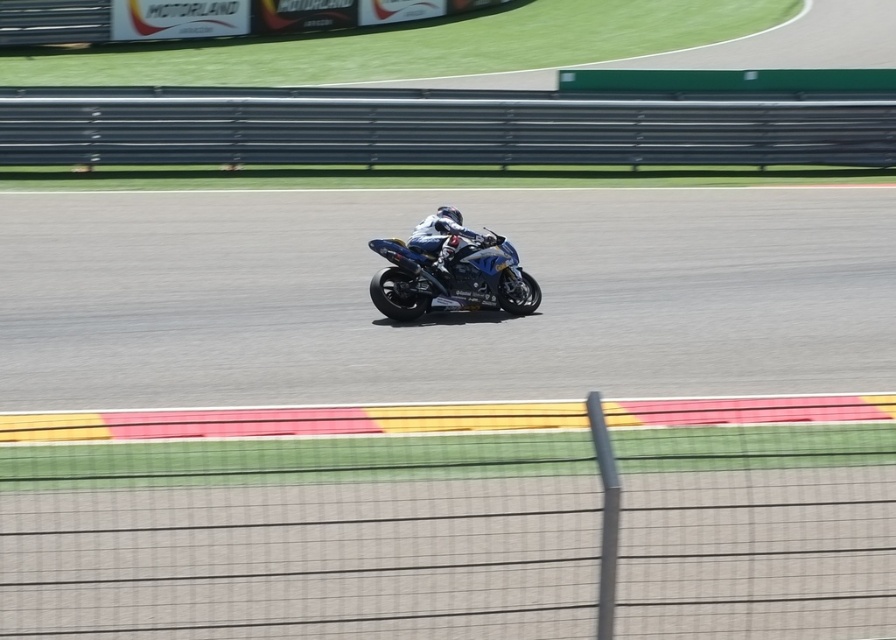
You are a photographer at the motor racing track. You want to take a photo of the blue metallic motorcycle at center and the white matte helmet at center. Which object should you zoom in on if you want to capture more details of the smaller one?

The white matte helmet at center is smaller than the blue metallic motorcycle at center, so you should zoom in on the white matte helmet at center to capture more details of the smaller one.

You are a drone operator trying to capture aerial footage of the motorcycle racer leaning into the turn. Your drone is currently hovering at a point that is 12.70 meters away from the camera. Is your drone positioned at point (397, 276)?

Yes, the point (397, 276) is 12.70 meters away from the camera, so the drone is positioned there.